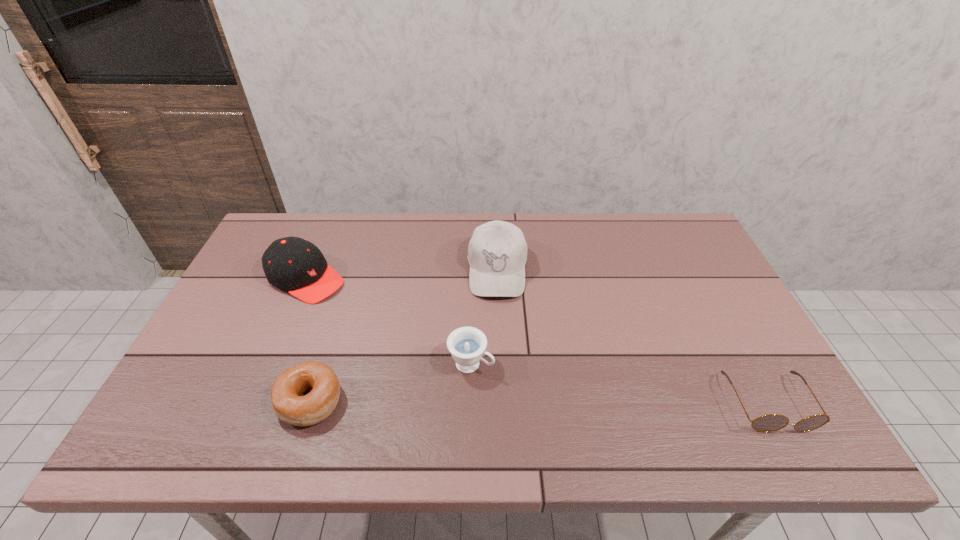
Identify the location of vacant region located 0.190m on the front-facing side of the baseball cap. Image resolution: width=960 pixels, height=540 pixels. (497, 356).

Locate an element on the screen. The width and height of the screenshot is (960, 540). blank space located 0.270m on the front-facing side of the baseball cap is located at coordinates (496, 383).

This screenshot has height=540, width=960. In order to click on free space located on the side of the teacup with the handle in this screenshot , I will do `click(562, 409)`.

The height and width of the screenshot is (540, 960). Identify the location of vacant space located on the side of the teacup with the handle. click(565, 411).

Identify the location of vacant space positioned on the side of the teacup with the handle. The width and height of the screenshot is (960, 540). (545, 401).

Locate an element on the screen. This screenshot has height=540, width=960. cap that is at the far edge is located at coordinates (293, 264).

What are the coordinates of `baseball cap that is at the far edge` in the screenshot? It's located at (497, 252).

Where is `bagel that is at the near edge`? The image size is (960, 540). bagel that is at the near edge is located at coordinates (318, 378).

Identify the location of sunglasses present at the near edge. (772, 422).

Locate an element on the screen. This screenshot has height=540, width=960. teacup present at the near edge is located at coordinates (466, 344).